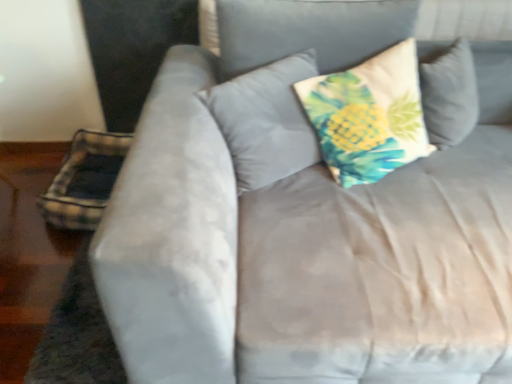
Question: From a real-world perspective, does printed fabric pillow at center, the 2th pillow from the left, sit lower than printed fabric pillow at center, which ranks as the third pillow in left-to-right order?

Choices:
 (A) no
 (B) yes

Answer: (B)

Question: From a real-world perspective, is printed fabric pillow at center, the second pillow from the right, over printed fabric pillow at center, which ranks as the third pillow in left-to-right order?

Choices:
 (A) no
 (B) yes

Answer: (A)

Question: Is printed fabric pillow at center, the 2th pillow from the left, turned away from printed fabric pillow at center, which is the 1th pillow from right to left?

Choices:
 (A) no
 (B) yes

Answer: (A)

Question: Is printed fabric pillow at center, the 2th pillow from the left, closer to camera compared to printed fabric pillow at center, which ranks as the third pillow in left-to-right order?

Choices:
 (A) yes
 (B) no

Answer: (B)

Question: Is printed fabric pillow at center, the 2th pillow from the left, shorter than printed fabric pillow at center, which is the 1th pillow from right to left?

Choices:
 (A) yes
 (B) no

Answer: (A)

Question: Can you confirm if printed fabric pillow at center, the 2th pillow from the left, is positioned to the right of printed fabric pillow at center, which ranks as the third pillow in left-to-right order?

Choices:
 (A) no
 (B) yes

Answer: (A)

Question: Is plaid fabric pillow at lower left, which is counted as the 3th pillow, starting from the right, not inside printed fabric pillow at center, the second pillow from the right?

Choices:
 (A) yes
 (B) no

Answer: (A)

Question: Does plaid fabric pillow at lower left, the 1th pillow in the left-to-right sequence, have a lesser width compared to printed fabric pillow at center, the second pillow from the right?

Choices:
 (A) yes
 (B) no

Answer: (B)

Question: From the image's perspective, is plaid fabric pillow at lower left, the 1th pillow in the left-to-right sequence, located above printed fabric pillow at center, the second pillow from the right?

Choices:
 (A) no
 (B) yes

Answer: (A)

Question: From a real-world perspective, does plaid fabric pillow at lower left, the 1th pillow in the left-to-right sequence, sit lower than printed fabric pillow at center, the 2th pillow from the left?

Choices:
 (A) yes
 (B) no

Answer: (A)

Question: Is plaid fabric pillow at lower left, the 1th pillow in the left-to-right sequence, bigger than printed fabric pillow at center, the 2th pillow from the left?

Choices:
 (A) yes
 (B) no

Answer: (A)

Question: Is plaid fabric pillow at lower left, the 1th pillow in the left-to-right sequence, looking in the opposite direction of printed fabric pillow at center, the 2th pillow from the left?

Choices:
 (A) yes
 (B) no

Answer: (B)

Question: From a real-world perspective, is printed fabric pillow at center, which is the 1th pillow from right to left, located higher than plaid fabric pillow at lower left, which is counted as the 3th pillow, starting from the right?

Choices:
 (A) no
 (B) yes

Answer: (B)